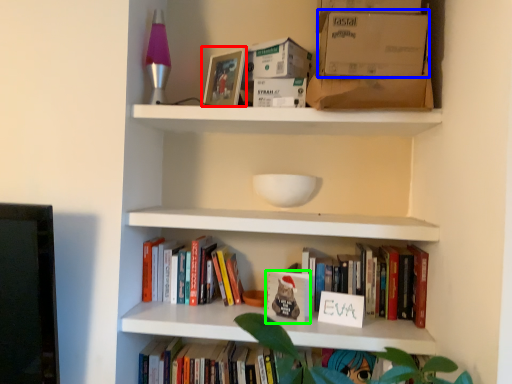
Question: Based on their relative distances, which object is nearer to picture frame (highlighted by a red box)? Choose from cardboard box (highlighted by a blue box) and paperback book (highlighted by a green box).

Choices:
 (A) cardboard box
 (B) paperback book

Answer: (A)